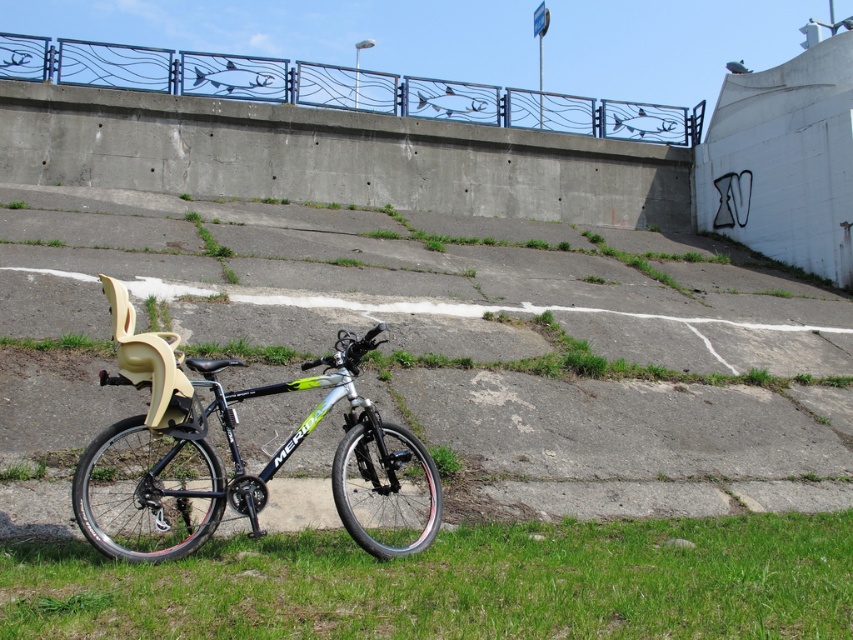
You are planning to ride the silver metallic bicycle at center across the green grass at lower center. Based on the scene description, is the grass area wide enough for the bicycle to pass through without touching the edges?

The green grass at lower center might be wider than silver metallic bicycle at center, so there is a possibility that the grass area is wide enough for the bicycle to pass through without touching the edges.

You are standing at the point marked by the coordinates point (241, 458). Looking around, you see a silver metallic bicycle at center. What is the object located at your current position?

The point (241, 458) marks the silver metallic bicycle at center, so the object at your current position is the silver metallic bicycle at center.